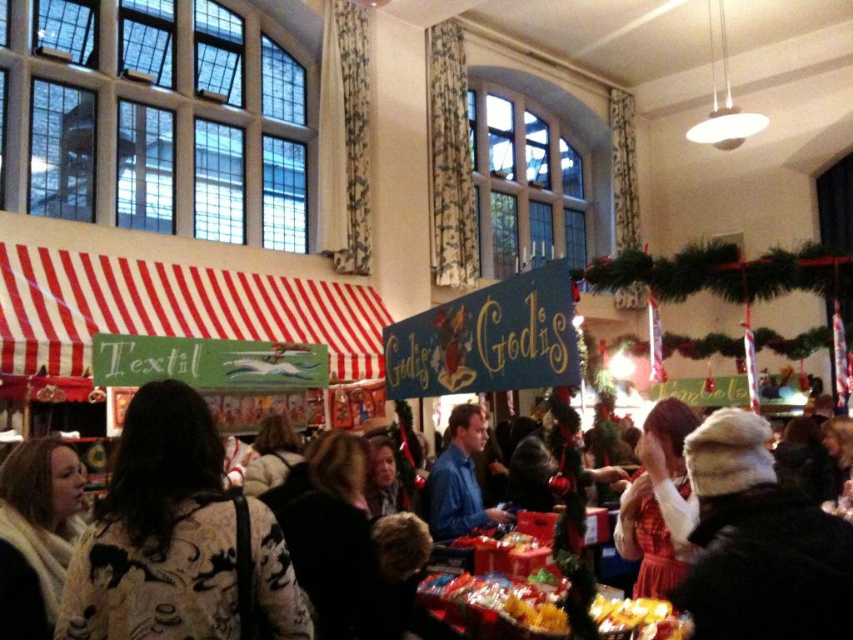
What do you see at coordinates (178, 540) in the screenshot? I see `fluffy white coat at center` at bounding box center [178, 540].

Is fluffy white coat at center closer to camera compared to white knit scarf at lower left?

Yes, fluffy white coat at center is in front of white knit scarf at lower left.

Which is behind, point (161, 609) or point (19, 512)?

The point (19, 512) is behind.

Locate an element on the screen. The width and height of the screenshot is (853, 640). fluffy white coat at center is located at coordinates (178, 540).

Is fluffy white coat at center bigger than fur-lined hat at center?

Yes, fluffy white coat at center is bigger than fur-lined hat at center.

Who is taller, fluffy white coat at center or fur-lined hat at center?

Standing taller between the two is fluffy white coat at center.

Is point (134, 572) behind point (792, 566)?

Yes, it is behind point (792, 566).

Locate an element on the screen. The width and height of the screenshot is (853, 640). fluffy white coat at center is located at coordinates (178, 540).

Does white knit scarf at lower left have a lesser width compared to blue cotton shirt at center?

Correct, white knit scarf at lower left's width is less than blue cotton shirt at center's.

Is point (44, 531) positioned behind point (456, 486)?

No, (44, 531) is closer to viewer.

The height and width of the screenshot is (640, 853). What are the coordinates of `white knit scarf at lower left` in the screenshot? It's located at (36, 532).